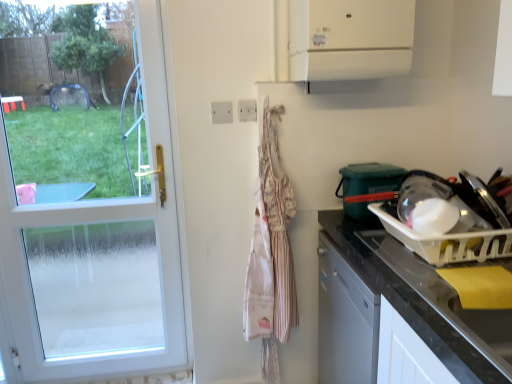
Question: Is transparent plastic bowl at right, which is counted as the second appliance, starting from the bottom, not inside white plastic electric outlet at upper center, the first electric outlet viewed from the left?

Choices:
 (A) yes
 (B) no

Answer: (A)

Question: Does transparent plastic bowl at right, the first appliance positioned from the top, contain white plastic electric outlet at upper center, the 2th electric outlet from the right?

Choices:
 (A) yes
 (B) no

Answer: (B)

Question: Considering the relative positions of transparent plastic bowl at right, which is counted as the second appliance, starting from the bottom, and white plastic electric outlet at upper center, the 2th electric outlet from the right, in the image provided, is transparent plastic bowl at right, which is counted as the second appliance, starting from the bottom, to the left of white plastic electric outlet at upper center, the 2th electric outlet from the right, from the viewer's perspective?

Choices:
 (A) yes
 (B) no

Answer: (B)

Question: From the image's perspective, is transparent plastic bowl at right, which is counted as the second appliance, starting from the bottom, on top of white plastic electric outlet at upper center, the 2th electric outlet from the right?

Choices:
 (A) no
 (B) yes

Answer: (A)

Question: Is transparent plastic bowl at right, the first appliance positioned from the top, oriented towards white plastic electric outlet at upper center, the first electric outlet viewed from the left?

Choices:
 (A) no
 (B) yes

Answer: (A)

Question: From the image's perspective, relative to white plastic dish rack at right, the first appliance when ordered from bottom to top, is black granite countertop at right above or below?

Choices:
 (A) below
 (B) above

Answer: (A)

Question: Considering their positions, is black granite countertop at right located in front of or behind white plastic dish rack at right, the first appliance when ordered from bottom to top?

Choices:
 (A) behind
 (B) front

Answer: (A)

Question: Is black granite countertop at right spatially inside white plastic dish rack at right, which ranks as the 2th appliance in top-to-bottom order, or outside of it?

Choices:
 (A) outside
 (B) inside

Answer: (A)

Question: Based on their positions, is black granite countertop at right located to the left or right of white plastic dish rack at right, which ranks as the 2th appliance in top-to-bottom order?

Choices:
 (A) left
 (B) right

Answer: (A)

Question: In the image, is white plastic dish rack at right, the first appliance when ordered from bottom to top, on the left side or the right side of striped fabric apron at center?

Choices:
 (A) left
 (B) right

Answer: (B)

Question: Is white plastic dish rack at right, the first appliance when ordered from bottom to top, in front of or behind striped fabric apron at center in the image?

Choices:
 (A) front
 (B) behind

Answer: (A)

Question: Is white plastic dish rack at right, the first appliance when ordered from bottom to top, situated inside striped fabric apron at center or outside?

Choices:
 (A) outside
 (B) inside

Answer: (A)

Question: In terms of size, does white plastic dish rack at right, the first appliance when ordered from bottom to top, appear bigger or smaller than striped fabric apron at center?

Choices:
 (A) small
 (B) big

Answer: (A)

Question: In terms of width, does transparent plastic bowl at right, which is counted as the second appliance, starting from the bottom, look wider or thinner when compared to white plastic electric outlet at upper center, the 2th electric outlet from the right?

Choices:
 (A) thin
 (B) wide

Answer: (B)

Question: Considering the positions of transparent plastic bowl at right, which is counted as the second appliance, starting from the bottom, and white plastic electric outlet at upper center, the first electric outlet viewed from the left, in the image, is transparent plastic bowl at right, which is counted as the second appliance, starting from the bottom, bigger or smaller than white plastic electric outlet at upper center, the first electric outlet viewed from the left,?

Choices:
 (A) big
 (B) small

Answer: (A)